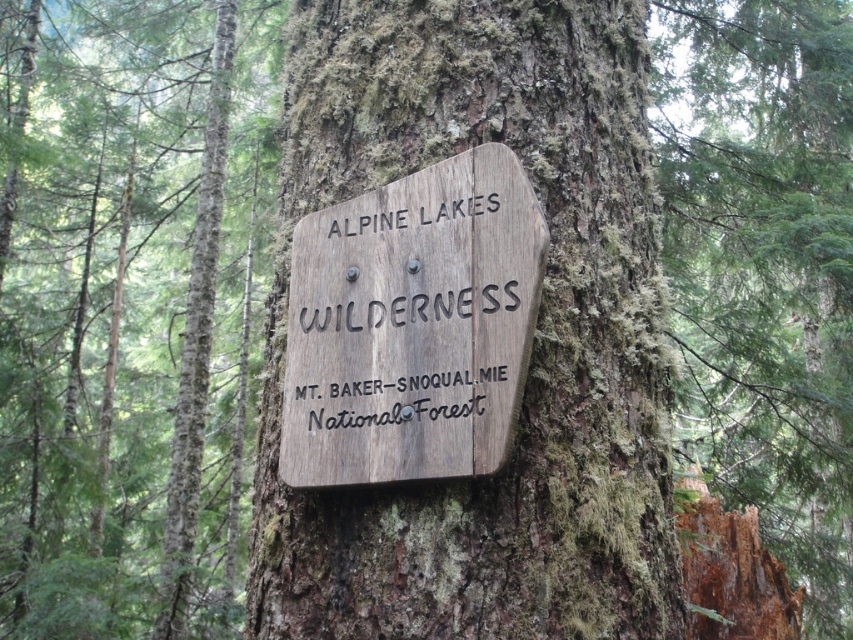
Question: In this image, where is weathered wood sign at center located relative to brown rough bark at center?

Choices:
 (A) left
 (B) right

Answer: (A)

Question: Among these objects, which one is farthest from the camera?

Choices:
 (A) weathered wood sign at center
 (B) brown rough bark at center

Answer: (A)

Question: From the image, what is the correct spatial relationship of weathered wood sign at center in relation to brown rough bark at center?

Choices:
 (A) above
 (B) below

Answer: (A)

Question: Does weathered wood sign at center have a smaller size compared to brown rough bark at center?

Choices:
 (A) yes
 (B) no

Answer: (A)

Question: Which is farther from the brown rough bark at center?

Choices:
 (A) weathered wood sign at center
 (B) wooden sign at center

Answer: (B)

Question: Which point is closer to the camera?

Choices:
 (A) (840, 524)
 (B) (477, 307)

Answer: (B)